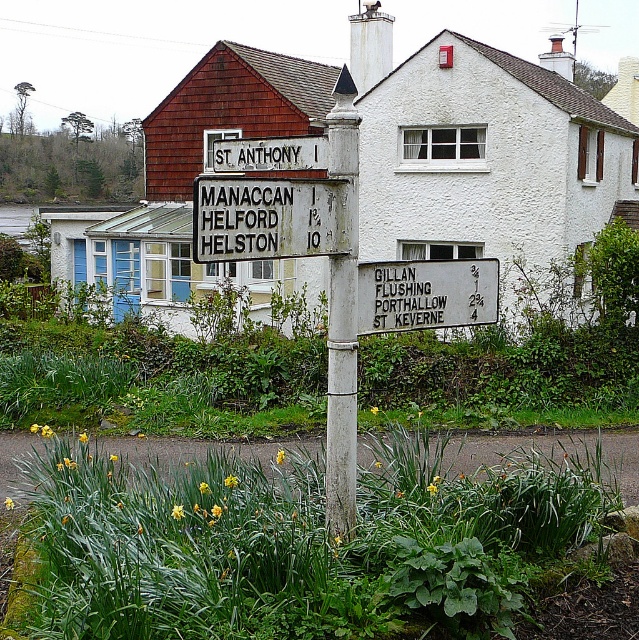
Between point (355, 330) and point (397, 324), which one is positioned behind?

The point (397, 324) is behind.

Does point (348, 268) come in front of point (452, 320)?

Yes.

Find the location of `white bamboo pole at center`. white bamboo pole at center is located at coordinates (343, 320).

At what (x,y) coordinates should I click in order to perform the action: click on weathered wood sign at center. Please return your answer as a coordinate pair (x, y). This screenshot has width=639, height=640. Looking at the image, I should click on (270, 218).

Who is lower down, weathered wood sign at center or white bamboo pole at center?

weathered wood sign at center

Is point (275, 188) less distant than point (341, 433)?

Yes, it is.

Find the location of a particular element. Image resolution: width=639 pixels, height=640 pixels. weathered wood sign at center is located at coordinates (270, 218).

Is weathered wood sign at center to the right of white painted wood sign at upper center from the viewer's perspective?

Indeed, weathered wood sign at center is positioned on the right side of white painted wood sign at upper center.

Which is above, weathered wood sign at center or white painted wood sign at upper center?

white painted wood sign at upper center

The height and width of the screenshot is (640, 639). Identify the location of weathered wood sign at center. (270, 218).